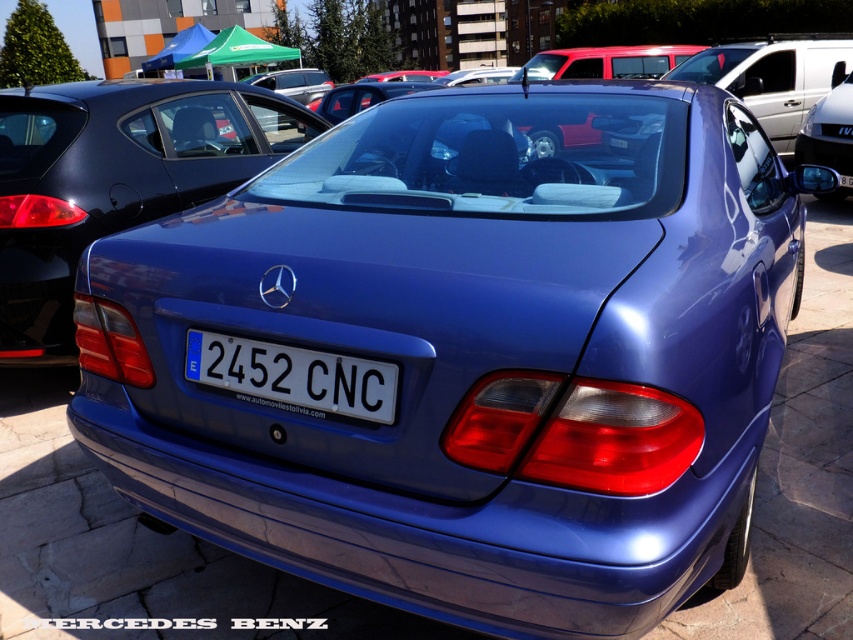
Is point (56, 253) positioned behind point (819, 195)?

No.

Based on the photo, which of these two, metallic blue sedan at center or metallic blue sedan at right, stands shorter?

metallic blue sedan at right

Describe the element at coordinates (114, 180) in the screenshot. Image resolution: width=853 pixels, height=640 pixels. I see `metallic blue sedan at center` at that location.

Locate an element on the screen. metallic blue sedan at center is located at coordinates (114, 180).

Is metallic blue sedan at center smaller than black plastic license plate at center?

Actually, metallic blue sedan at center might be larger than black plastic license plate at center.

Image resolution: width=853 pixels, height=640 pixels. Identify the location of metallic blue sedan at center. pyautogui.click(x=114, y=180).

Which is behind, point (198, 364) or point (845, 116)?

Point (845, 116)

Does black plastic license plate at center come in front of metallic blue sedan at right?

Yes, it is.

Who is more forward, (328, 404) or (811, 104)?

Point (328, 404) is more forward.

The width and height of the screenshot is (853, 640). What are the coordinates of `black plastic license plate at center` in the screenshot? It's located at (293, 374).